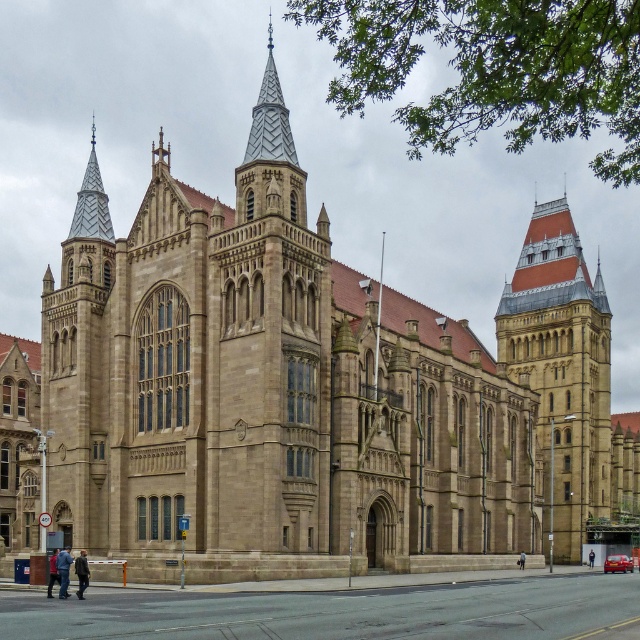
Question: Is brown stone tower at upper right wider than silver mosaic spire at upper left?

Choices:
 (A) yes
 (B) no

Answer: (A)

Question: Is brown stone tower at upper right to the left of silver mosaic spire at upper left from the viewer's perspective?

Choices:
 (A) no
 (B) yes

Answer: (A)

Question: Does brown stone tower at upper right appear on the left side of silver mosaic spire at upper left?

Choices:
 (A) no
 (B) yes

Answer: (A)

Question: Among these objects, which one is nearest to the camera?

Choices:
 (A) brown stone tower at upper right
 (B) silver mosaic spire at upper left

Answer: (B)

Question: Which point is closer to the camera?

Choices:
 (A) silver mosaic spire at upper left
 (B) brown stone tower at upper right

Answer: (A)